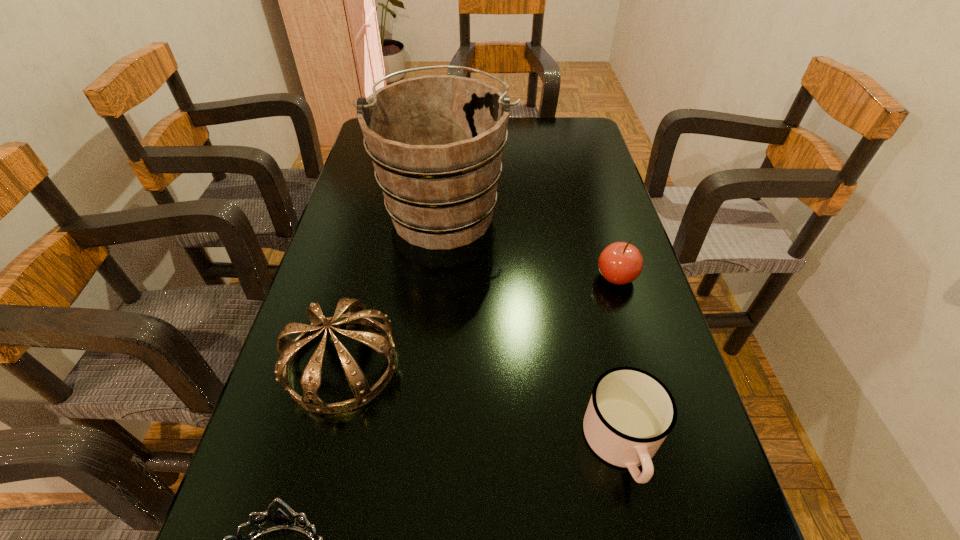
Image resolution: width=960 pixels, height=540 pixels. Identify the location of free spot located on the back of the apple. (591, 193).

The width and height of the screenshot is (960, 540). What are the coordinates of `vacant space situated 0.050m on the side of the mug with the handle` in the screenshot? It's located at (642, 532).

This screenshot has width=960, height=540. Identify the location of bucket that is at the left edge. (436, 142).

This screenshot has width=960, height=540. I want to click on tiara present at the left edge, so (358, 313).

Where is `apple situated at the right edge`? Image resolution: width=960 pixels, height=540 pixels. apple situated at the right edge is located at coordinates (620, 263).

Image resolution: width=960 pixels, height=540 pixels. Identify the location of mug present at the right edge. (630, 413).

Where is `free region at the far edge of the desktop`? Image resolution: width=960 pixels, height=540 pixels. free region at the far edge of the desktop is located at coordinates (531, 151).

The image size is (960, 540). What are the coordinates of `free space at the left edge of the desktop` in the screenshot? It's located at (341, 462).

Image resolution: width=960 pixels, height=540 pixels. I want to click on vacant region at the right edge of the desktop, so click(x=561, y=171).

In the image, there is a desktop. At what (x,y) coordinates should I click in order to perform the action: click on vacant area at the far right corner. Please return your answer as a coordinate pair (x, y). Looking at the image, I should click on (586, 127).